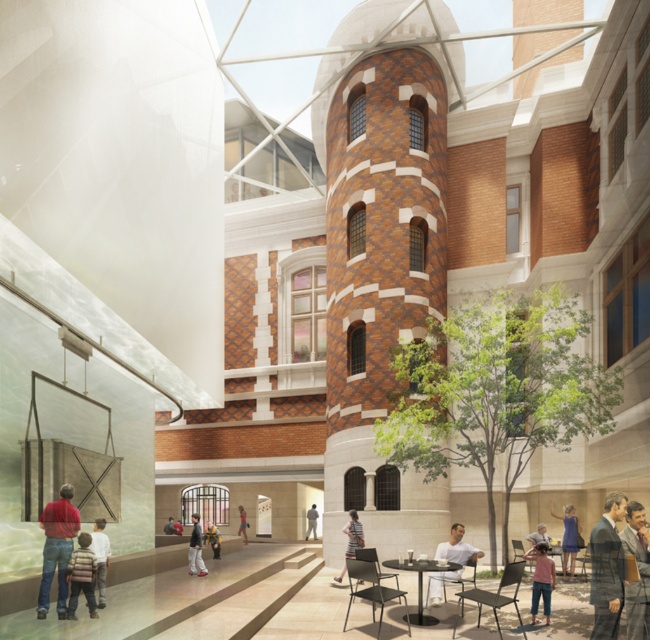
Locate an element on the screen. This screenshot has height=640, width=650. striped shirt at lower left is located at coordinates (99, 557).

Is striped shirt at lower left wider than gray fabric at center?

Yes.

Image resolution: width=650 pixels, height=640 pixels. What do you see at coordinates (99, 557) in the screenshot?
I see `striped shirt at lower left` at bounding box center [99, 557].

Locate an element on the screen. The width and height of the screenshot is (650, 640). striped shirt at lower left is located at coordinates (99, 557).

Is striped sweater at lower left positioned behind striped fabric shirt at center?

No, it is in front of striped fabric shirt at center.

Which of these two, striped sweater at lower left or striped fabric shirt at center, stands shorter?

striped fabric shirt at center is shorter.

This screenshot has height=640, width=650. What do you see at coordinates (81, 576) in the screenshot?
I see `striped sweater at lower left` at bounding box center [81, 576].

You are a GUI agent. You are given a task and a screenshot of the screen. Output one action in this format:
    pyautogui.click(x=<x>, y=<y>)
    Task: Click on the striped sweater at lower left
    Image resolution: width=650 pixels, height=640 pixels.
    Given the screenshot: What is the action you would take?
    pyautogui.click(x=81, y=576)

Who is more forward, (65, 531) or (419, 604)?

Positioned in front is point (65, 531).

Is point (46, 508) closer to camera compared to point (448, 568)?

Yes, point (46, 508) is closer to viewer.

Where is `denim jeans at lower left`? The image size is (650, 640). denim jeans at lower left is located at coordinates (57, 548).